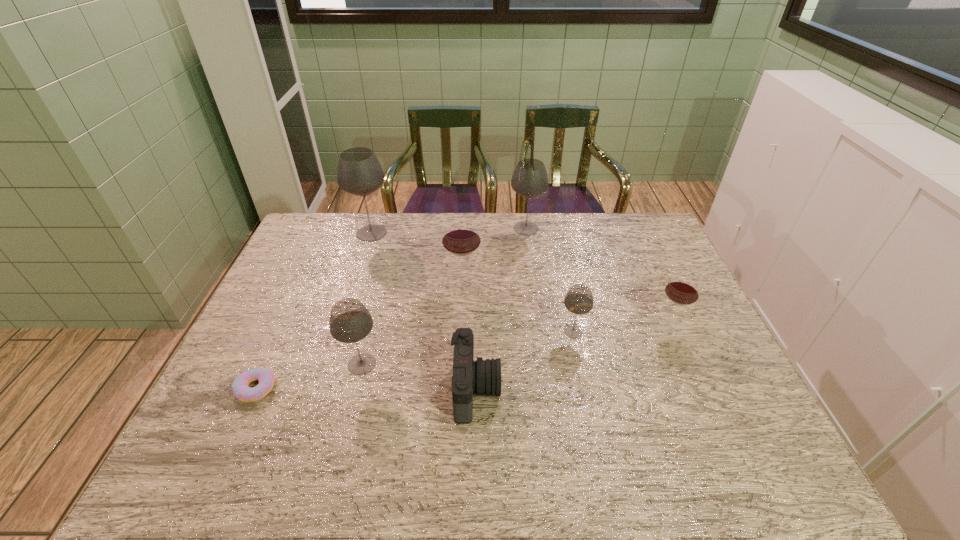
What are the coordinates of `unoccupied area between the right red wineglass and the nearest gray wineglass` in the screenshot? It's located at (516, 344).

Find the location of `empty location between the fourth wineglass from right to left and the third farthest gray wineglass`. empty location between the fourth wineglass from right to left and the third farthest gray wineglass is located at coordinates (518, 307).

This screenshot has width=960, height=540. In order to click on blank region between the camera and the biggest gray wineglass in this screenshot , I will do [423, 311].

Where is `vacant space in between the nearer red wineglass and the seventh shortest object`? The image size is (960, 540). vacant space in between the nearer red wineglass and the seventh shortest object is located at coordinates (598, 276).

The height and width of the screenshot is (540, 960). In order to click on free spot between the second tallest wineglass and the third wineglass from left to right in this screenshot , I will do `click(494, 255)`.

Find the location of a particular element. object that is the fifth closest to the second tallest wineglass is located at coordinates (481, 376).

Identify the location of object that is the second closest to the farther red wineglass. (359, 172).

Locate an element on the screen. This screenshot has height=540, width=960. wineglass that can be found as the fifth closest to the fourth nearest wineglass is located at coordinates (682, 289).

Image resolution: width=960 pixels, height=540 pixels. Identify the location of wineglass identified as the second closest to the biggest gray wineglass. (529, 179).

Point out which gray wineglass is positioned as the fourth nearest to the doughnut. Please provide its 2D coordinates. Your answer should be formatted as a tuple, i.e. [(x, y)], where the tuple contains the x and y coordinates of a point satisfying the conditions above.

[(529, 179)]